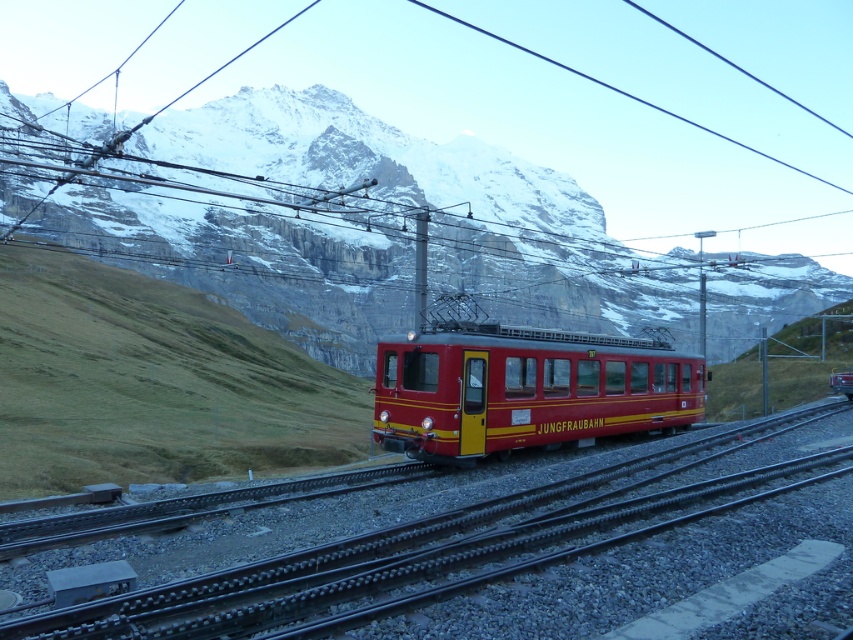
Which is in front, point (410, 589) or point (434, 369)?

Point (410, 589)

Between metallic train track at center and matte red train at center, which one appears on the left side from the viewer's perspective?

From the viewer's perspective, metallic train track at center appears more on the left side.

Does point (606, 538) lie behind point (613, 348)?

No.

I want to click on metallic train track at center, so click(450, 547).

Which is below, snowy rock at center or matte red train at center?

Positioned lower is matte red train at center.

Can you confirm if snowy rock at center is positioned below matte red train at center?

No.

Which is behind, point (223, 147) or point (430, 460)?

Point (223, 147)

Locate an element on the screen. snowy rock at center is located at coordinates (337, 221).

Is snowy rock at center below metallic train track at center?

No.

Who is positioned more to the left, snowy rock at center or metallic train track at center?

From the viewer's perspective, snowy rock at center appears more on the left side.

Locate an element on the screen. snowy rock at center is located at coordinates (337, 221).

Locate an element on the screen. snowy rock at center is located at coordinates (337, 221).